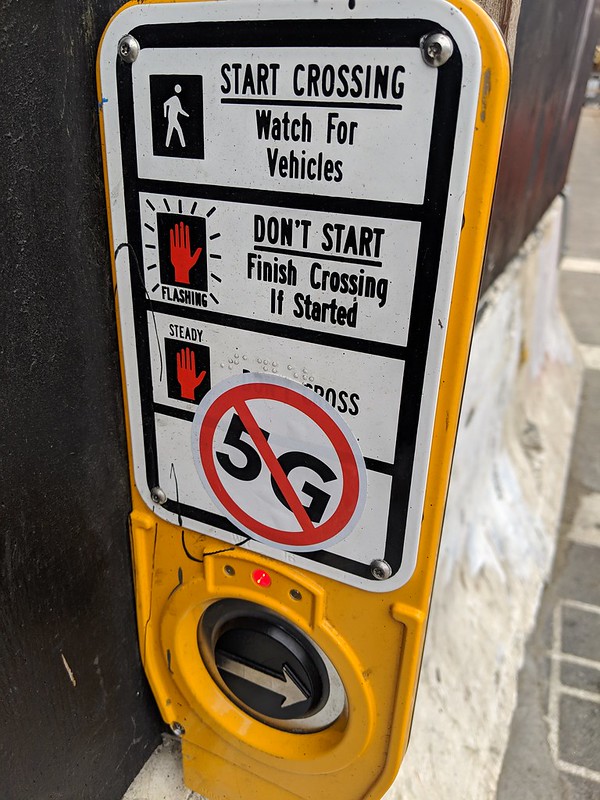
Where is `left most wall`? left most wall is located at coordinates (26, 614).